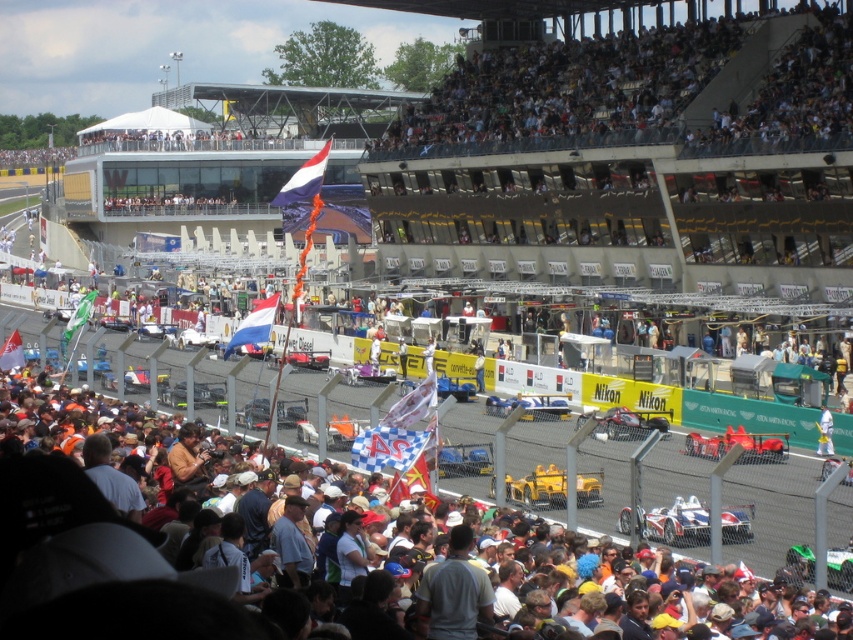
You are a drone operator assigned to capture aerial footage of the Formula One race. Your drone needs to fly from the blue and white fabric flag at upper center to the nearest point on the racetrack. What is the shortest distance the drone must travel?

The blue and white fabric flag at upper center is located at point [305,179]. The nearest point on the racetrack would be the closest point along the track to this coordinate. The shortest distance would be the straight line from the flag to this point.

You are a race commentator watching the Formula One race. You notice the yellow matte race car at center and the blue and white fabric flag at upper center. Which object is closer to the spectators behind the fence?

The yellow matte race car at center is closer to the spectators behind the fence because it is in front of the blue and white fabric flag at upper center.

You are a photographer at the Formula One race. You need to capture a photo of the white fabric flag at center without the white plastic seats at upper center blocking the view. Is this possible given their sizes?

The white plastic seats at upper center is bigger than the white fabric flag at center, so it might block the view. Adjust your angle or position to ensure the smaller white fabric flag at center is framed properly.